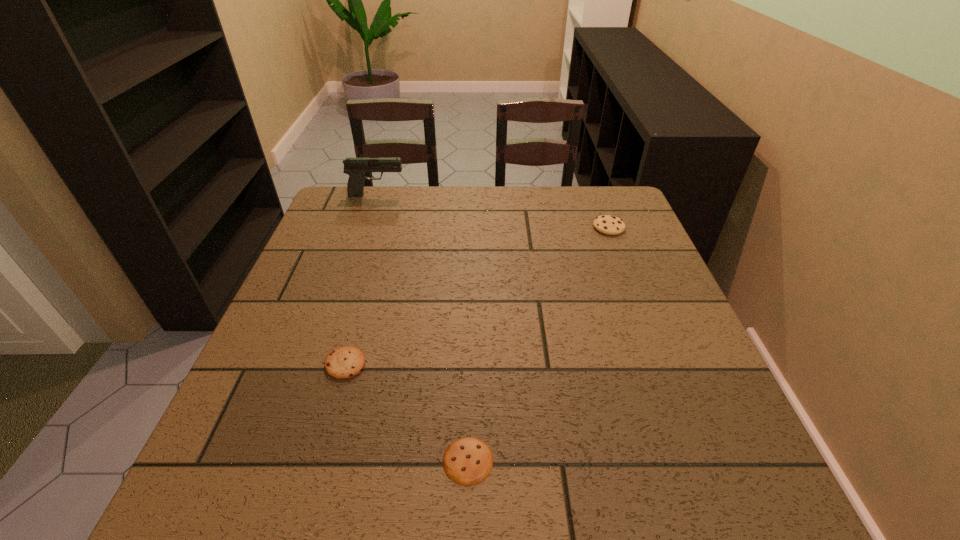
Where is `free space that satisfies the following two spatial constraints: 1. on the back side of the rightmost object; 2. on the right side of the second nearest object`? free space that satisfies the following two spatial constraints: 1. on the back side of the rightmost object; 2. on the right side of the second nearest object is located at coordinates (384, 227).

Identify the location of vacant space that satisfies the following two spatial constraints: 1. aim along the barrel of the tallest object; 2. on the left side of the second tallest cookie. Image resolution: width=960 pixels, height=540 pixels. (320, 364).

Locate an element on the screen. vacant space that satisfies the following two spatial constraints: 1. on the front side of the nearest cookie; 2. on the left side of the second nearest cookie is located at coordinates (318, 461).

This screenshot has width=960, height=540. I want to click on vacant space that satisfies the following two spatial constraints: 1. aim along the barrel of the nearest object; 2. on the left side of the tallest object, so click(x=287, y=461).

Identify the location of vacant point that satisfies the following two spatial constraints: 1. aim along the barrel of the pistol; 2. on the left side of the second tallest cookie. (320, 364).

What are the coordinates of `blank area in the image that satisfies the following two spatial constraints: 1. aim along the barrel of the tallest object; 2. on the right side of the second tallest cookie` in the screenshot? It's located at (320, 364).

The width and height of the screenshot is (960, 540). Find the location of `free space that satisfies the following two spatial constraints: 1. aim along the barrel of the tallest object; 2. on the left side of the second farthest cookie`. free space that satisfies the following two spatial constraints: 1. aim along the barrel of the tallest object; 2. on the left side of the second farthest cookie is located at coordinates (320, 364).

Identify the location of free space in the image that satisfies the following two spatial constraints: 1. aim along the barrel of the tallest object; 2. on the right side of the second farthest cookie. click(x=320, y=364).